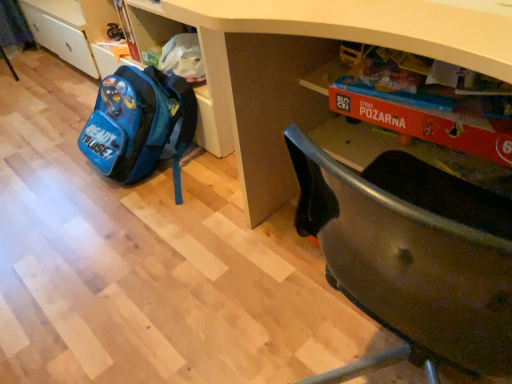
Identify the location of free location to the left of white matte desk at center. (199, 317).